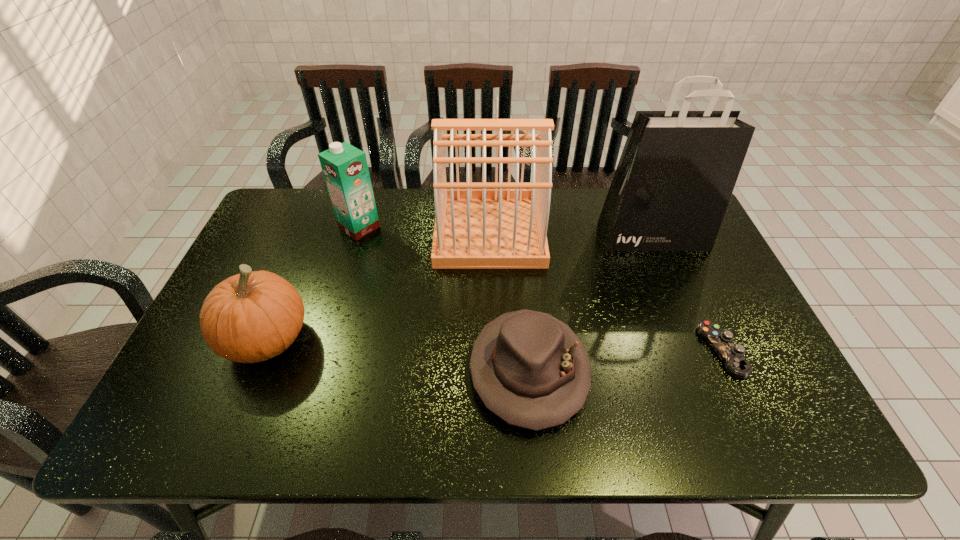
Where is `shopping bag`? The height and width of the screenshot is (540, 960). shopping bag is located at coordinates (677, 171).

You are a GUI agent. You are given a task and a screenshot of the screen. Output one action in this format:
    pyautogui.click(x=<x>, y=<y>)
    Task: Click on the birdcage
    
    Given the screenshot: What is the action you would take?
    pyautogui.click(x=478, y=225)

At what (x,y) coordinates should I click in order to perform the action: click on carton. Please return your answer as a coordinate pair (x, y). The image size is (960, 540). Looking at the image, I should click on (345, 169).

Find the location of a particular element. The image size is (960, 540). pumpkin is located at coordinates (251, 317).

You are a GUI agent. You are given a task and a screenshot of the screen. Output one action in this format:
    pyautogui.click(x=<x>, y=<y>)
    Task: Click on the fifth tallest object
    The height and width of the screenshot is (540, 960).
    Given the screenshot: What is the action you would take?
    pyautogui.click(x=530, y=369)

Where is `the shortest object`? Image resolution: width=960 pixels, height=540 pixels. the shortest object is located at coordinates (731, 354).

Where is `free location located on the front with handles of the shopping bag`? Image resolution: width=960 pixels, height=540 pixels. free location located on the front with handles of the shopping bag is located at coordinates (704, 360).

What are the coordinates of `free space located with an open door on the birdcage` in the screenshot? It's located at (321, 231).

Image resolution: width=960 pixels, height=540 pixels. What are the coordinates of `vacant area located 0.370m with an open door on the birdcage` in the screenshot? It's located at (318, 231).

At what (x,y) coordinates should I click in order to perform the action: click on vacant space located with an open door on the birdcage. Please return your answer as a coordinate pair (x, y). The image size is (960, 540). Looking at the image, I should click on (385, 231).